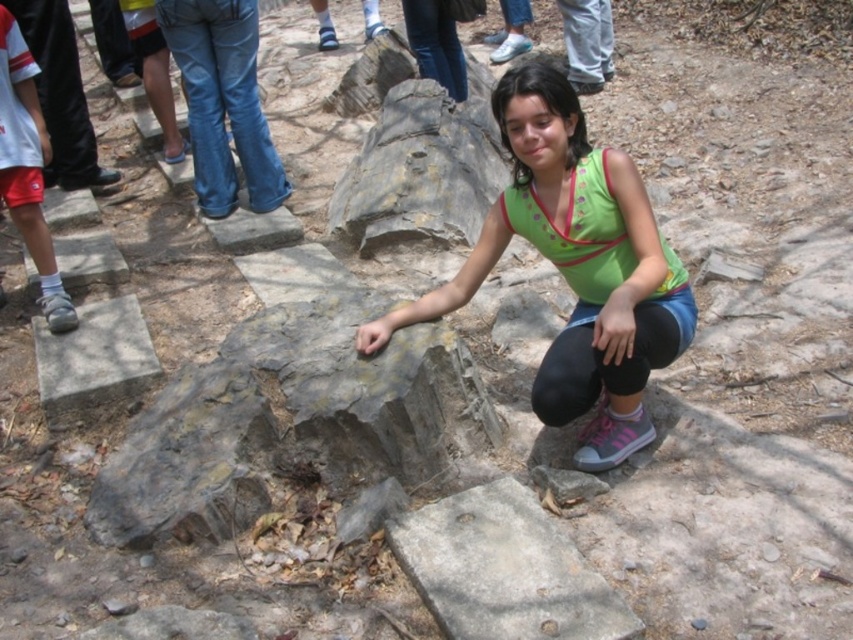
Question: Which of the following is the farthest from the observer?

Choices:
 (A) green fabric shirt at center
 (B) gray concrete block at lower left

Answer: (B)

Question: Where is green fabric shirt at center located in relation to gray rough stone at lower center in the image?

Choices:
 (A) below
 (B) above

Answer: (B)

Question: Can you confirm if gray rough stone at lower center is positioned below gray concrete block at lower left?

Choices:
 (A) yes
 (B) no

Answer: (A)

Question: Among these objects, which one is farthest from the camera?

Choices:
 (A) gray concrete block at lower left
 (B) gray rough stone at lower center
 (C) green fabric shirt at center

Answer: (A)

Question: Does gray rough stone at lower center have a smaller size compared to gray concrete block at lower left?

Choices:
 (A) yes
 (B) no

Answer: (A)

Question: Among these objects, which one is farthest from the camera?

Choices:
 (A) gray concrete block at lower left
 (B) green fabric shirt at center

Answer: (A)